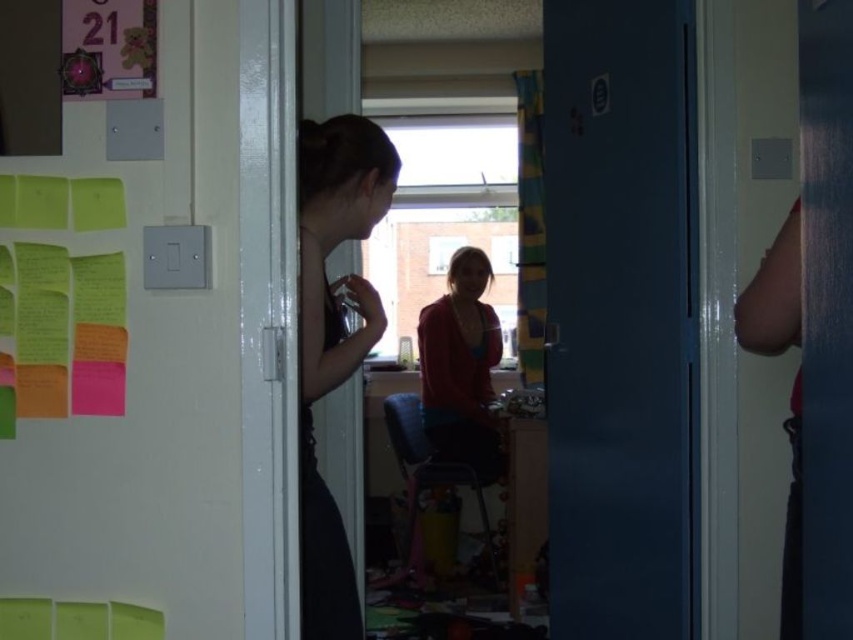
Does matte red sweater at center have a lesser height compared to green paper at upper left?

In fact, matte red sweater at center may be taller than green paper at upper left.

Where is `matte red sweater at center`? This screenshot has width=853, height=640. matte red sweater at center is located at coordinates (461, 368).

Can you confirm if multicolored sticky notes at left is bigger than blue matte door at center?

Actually, multicolored sticky notes at left might be smaller than blue matte door at center.

Who is more distant from viewer, [115,420] or [680,460]?

Positioned behind is point [680,460].

Image resolution: width=853 pixels, height=640 pixels. What do you see at coordinates (126, 362) in the screenshot? I see `multicolored sticky notes at left` at bounding box center [126, 362].

I want to click on multicolored sticky notes at left, so click(126, 362).

Does blue matte door at center come behind green paper at upper left?

Yes, blue matte door at center is further from the viewer.

Does point (576, 156) come closer to viewer compared to point (107, 216)?

No, (576, 156) is behind (107, 216).

Locate an element on the screen. The image size is (853, 640). blue matte door at center is located at coordinates (619, 316).